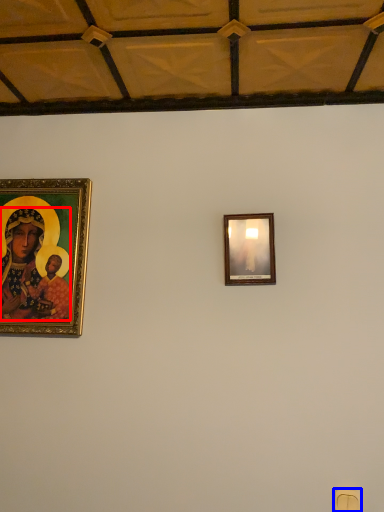
Question: Which object appears closest to the camera in this image, person (highlighted by a red box) or light switch (highlighted by a blue box)?

Choices:
 (A) person
 (B) light switch

Answer: (B)